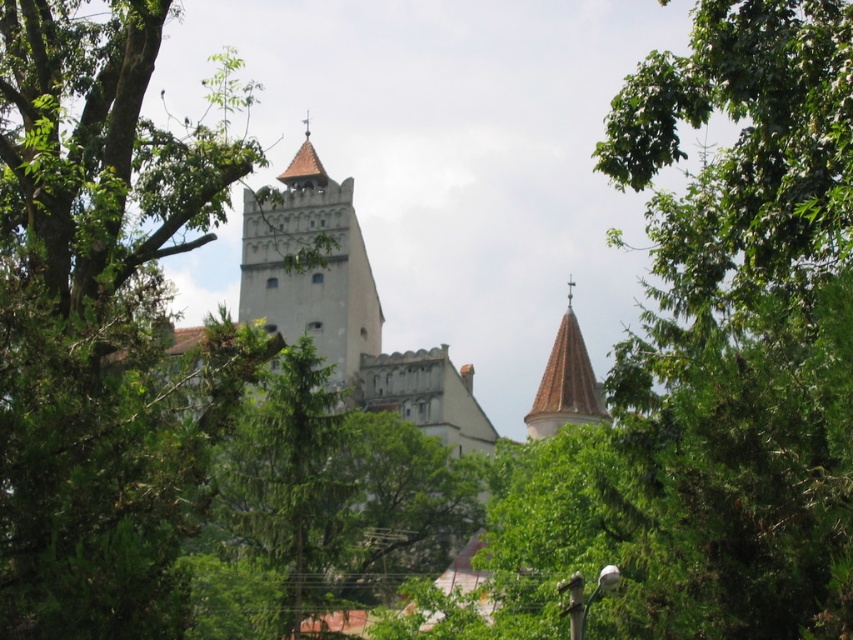
You are standing in front of the castle structure and notice two towers. Which tower, the white stone tower at center or the white stucco tower at upper center, is positioned higher up in the image?

The white stone tower at center is positioned higher up in the image than the white stucco tower at upper center.

You are a drone operator planning to fly a drone between the white stone tower at center and the white stucco tower at upper center. The drone has a maximum flight distance of 60 feet. Can the drone safely travel between these two towers without exceeding its range?

The distance between the white stone tower at center and the white stucco tower at upper center is 61.47 feet, which exceeds the drone s maximum flight distance of 60 feet. Therefore, the drone cannot safely travel between them without exceeding its range.

You are standing at the edge of the forest looking towards the castle. You see a green leafy tree at center and a white stone tower at center. How far apart are these two landmarks?

The green leafy tree at center is 111.50 feet away from the white stone tower at center.